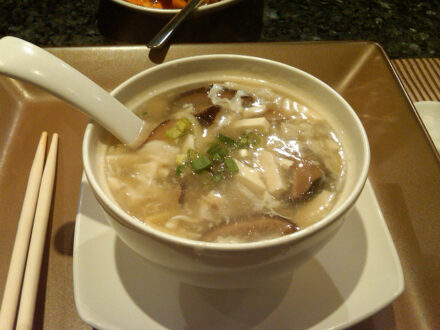
At what (x,y) coordinates should I click in order to perform the action: click on large soup spoon. Please return your answer as a coordinate pair (x, y). This screenshot has width=440, height=330. Looking at the image, I should click on (65, 92).